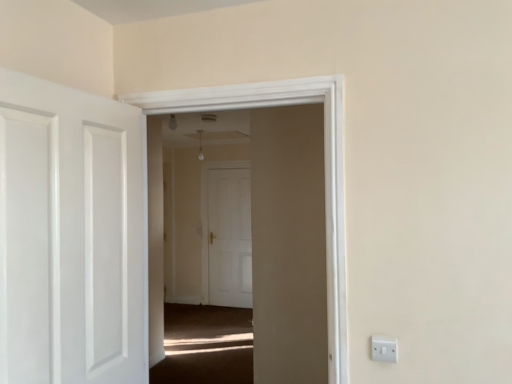
Question: Considering their positions, is white plastic switch at lower right located in front of or behind white glossy door at left, which is the 1th door from front to back?

Choices:
 (A) behind
 (B) front

Answer: (A)

Question: Based on their positions, is white plastic switch at lower right located to the left or right of white glossy door at left, the 2th door from the back?

Choices:
 (A) left
 (B) right

Answer: (B)

Question: Which is nearer to the white matte door at center, the 2th door viewed from the front?

Choices:
 (A) transparent glass door at center
 (B) white glossy door at left, the 2th door from the back
 (C) white plastic switch at lower right

Answer: (A)

Question: Estimate the real-world distances between objects in this image. Which object is closer to the white plastic switch at lower right?

Choices:
 (A) white glossy door at left, which is the 1th door from front to back
 (B) transparent glass door at center
 (C) white matte door at center, the 1th door viewed from the back

Answer: (B)